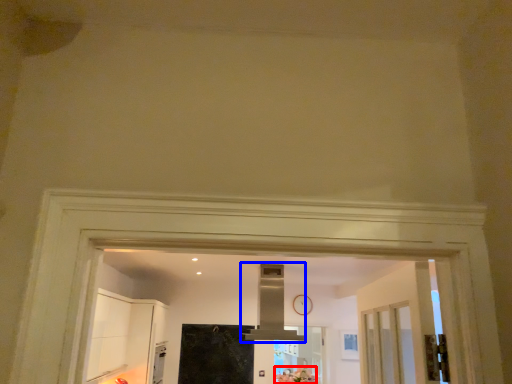
Question: Which of the following is the closest to the observer, flower (highlighted by a red box) or exhaust hood (highlighted by a blue box)?

Choices:
 (A) flower
 (B) exhaust hood

Answer: (B)